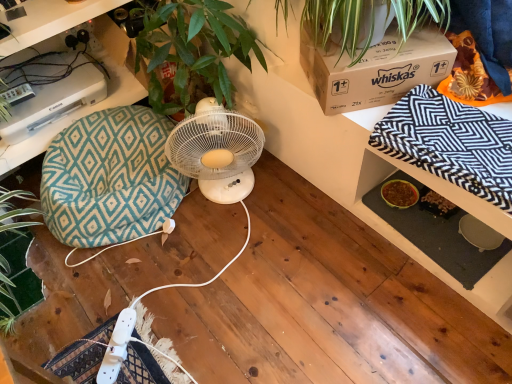
Question: Does teal diamond-patterned bean bag chair at left have a greater width compared to teal fabric cushion at left?

Choices:
 (A) yes
 (B) no

Answer: (A)

Question: Is the depth of teal diamond-patterned bean bag chair at left greater than that of teal fabric cushion at left?

Choices:
 (A) yes
 (B) no

Answer: (B)

Question: Would you say teal diamond-patterned bean bag chair at left is outside teal fabric cushion at left?

Choices:
 (A) no
 (B) yes

Answer: (B)

Question: From the image's perspective, is teal diamond-patterned bean bag chair at left beneath teal fabric cushion at left?

Choices:
 (A) no
 (B) yes

Answer: (B)

Question: Is teal diamond-patterned bean bag chair at left thinner than teal fabric cushion at left?

Choices:
 (A) yes
 (B) no

Answer: (B)

Question: From a real-world perspective, is teal diamond-patterned bean bag chair at left positioned above or below white plastic fan at center?

Choices:
 (A) below
 (B) above

Answer: (A)

Question: From the image's perspective, relative to white plastic fan at center, is teal diamond-patterned bean bag chair at left above or below?

Choices:
 (A) above
 (B) below

Answer: (B)

Question: Considering the positions of teal diamond-patterned bean bag chair at left and white plastic fan at center in the image, is teal diamond-patterned bean bag chair at left wider or thinner than white plastic fan at center?

Choices:
 (A) thin
 (B) wide

Answer: (B)

Question: Considering the positions of teal diamond-patterned bean bag chair at left and white plastic fan at center in the image, is teal diamond-patterned bean bag chair at left taller or shorter than white plastic fan at center?

Choices:
 (A) short
 (B) tall

Answer: (A)

Question: Do you think white plastic fan at center is within black and white zigzag blanket at upper right, or outside of it?

Choices:
 (A) inside
 (B) outside

Answer: (B)

Question: Considering the positions of white plastic fan at center and black and white zigzag blanket at upper right in the image, is white plastic fan at center taller or shorter than black and white zigzag blanket at upper right?

Choices:
 (A) short
 (B) tall

Answer: (B)

Question: Is point (228, 132) closer or farther from the camera than point (462, 153)?

Choices:
 (A) closer
 (B) farther

Answer: (B)

Question: From a real-world perspective, is white plastic fan at center above or below black and white zigzag blanket at upper right?

Choices:
 (A) above
 (B) below

Answer: (B)

Question: From a real-world perspective, relative to brown cardboard box at upper right, is teal diamond-patterned bean bag chair at left vertically above or below?

Choices:
 (A) below
 (B) above

Answer: (A)

Question: Considering their positions, is teal diamond-patterned bean bag chair at left located in front of or behind brown cardboard box at upper right?

Choices:
 (A) front
 (B) behind

Answer: (B)